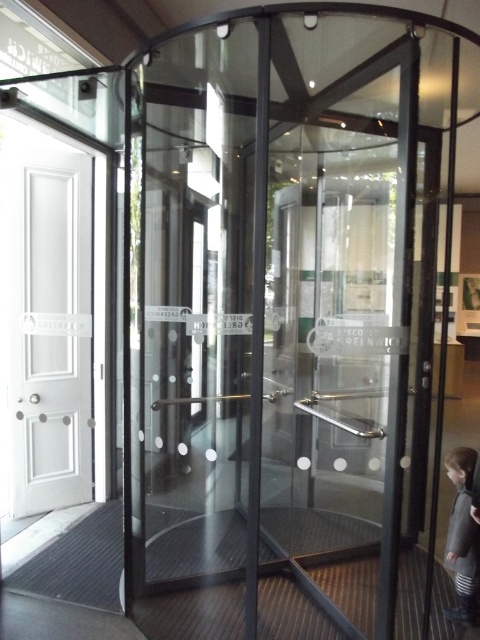
Question: Which of the following is the farthest from the observer?

Choices:
 (A) dark gray coat at lower right
 (B) transparent glass door at center

Answer: (A)

Question: Which of these objects is positioned closest to the white matte door at left?

Choices:
 (A) transparent glass door at center
 (B) dark gray coat at lower right

Answer: (A)

Question: In this image, where is transparent glass door at center located relative to white matte door at left?

Choices:
 (A) below
 (B) above

Answer: (A)

Question: Which object is positioned closest to the white matte door at left?

Choices:
 (A) transparent glass door at center
 (B) dark gray coat at lower right

Answer: (A)

Question: Does transparent glass door at center come in front of white matte door at left?

Choices:
 (A) no
 (B) yes

Answer: (B)

Question: Does transparent glass door at center appear under dark gray coat at lower right?

Choices:
 (A) no
 (B) yes

Answer: (A)